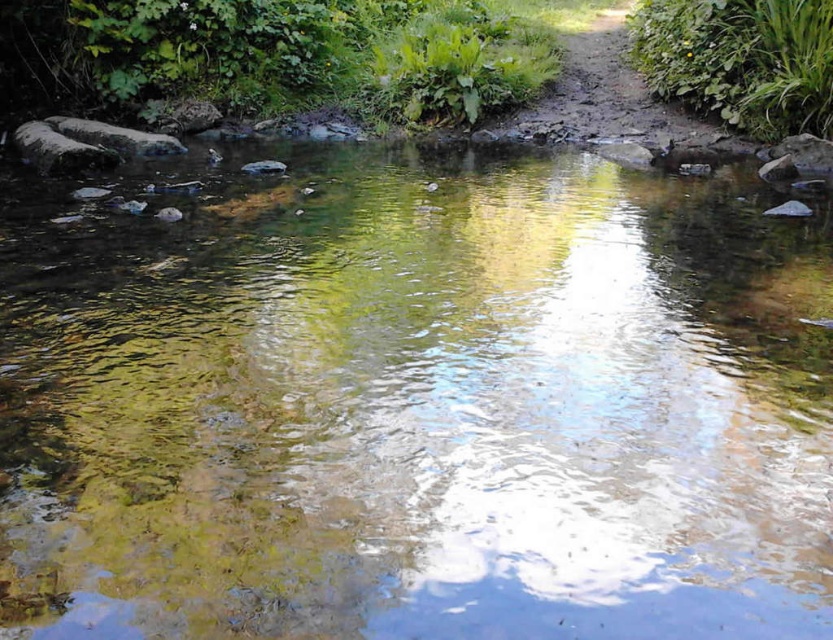
Question: Does green leafy plant at upper right appear over dirt path at upper center?

Choices:
 (A) yes
 (B) no

Answer: (A)

Question: Which object appears farthest from the camera in this image?

Choices:
 (A) green leafy plant at upper right
 (B) dirt path at upper center
 (C) green leafy plants at upper center

Answer: (C)

Question: Can you confirm if green leafy plant at upper right is smaller than dirt path at upper center?

Choices:
 (A) no
 (B) yes

Answer: (A)

Question: Is green leafy plants at upper center thinner than dirt path at upper center?

Choices:
 (A) yes
 (B) no

Answer: (B)

Question: Which object is closer to the camera taking this photo?

Choices:
 (A) green leafy plants at upper center
 (B) green leafy plant at upper right
 (C) dirt path at upper center

Answer: (B)

Question: Which point is farther to the camera?

Choices:
 (A) dirt path at upper center
 (B) green leafy plants at upper center
 (C) green leafy plant at upper right

Answer: (B)